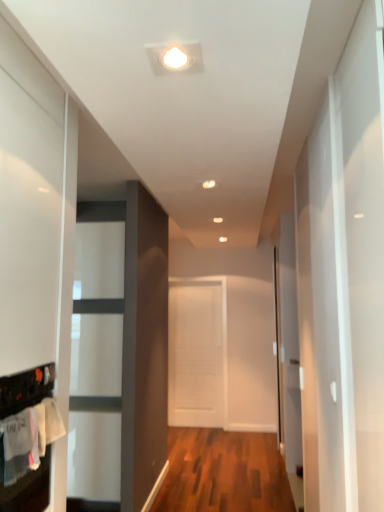
Question: From a real-world perspective, does white matte door at center sit lower than transparent glass door at right?

Choices:
 (A) yes
 (B) no

Answer: (A)

Question: Is white matte door at center taller than transparent glass door at right?

Choices:
 (A) yes
 (B) no

Answer: (B)

Question: Can you confirm if white matte door at center is wider than transparent glass door at right?

Choices:
 (A) no
 (B) yes

Answer: (A)

Question: Can you confirm if white matte door at center is smaller than transparent glass door at right?

Choices:
 (A) no
 (B) yes

Answer: (B)

Question: Would you say white matte door at center contains transparent glass door at right?

Choices:
 (A) yes
 (B) no

Answer: (B)

Question: Is white matte door at center outside transparent glass door at right?

Choices:
 (A) yes
 (B) no

Answer: (A)

Question: Is white cotton laundry at lower left thinner than white matte door at center?

Choices:
 (A) yes
 (B) no

Answer: (A)

Question: From the image's perspective, is white cotton laundry at lower left beneath white matte door at center?

Choices:
 (A) no
 (B) yes

Answer: (A)

Question: Can you confirm if white cotton laundry at lower left is smaller than white matte door at center?

Choices:
 (A) yes
 (B) no

Answer: (A)

Question: Considering the relative positions of white cotton laundry at lower left and white matte door at center in the image provided, is white cotton laundry at lower left to the right of white matte door at center from the viewer's perspective?

Choices:
 (A) yes
 (B) no

Answer: (B)

Question: Is the depth of white cotton laundry at lower left greater than that of white matte door at center?

Choices:
 (A) yes
 (B) no

Answer: (B)

Question: Does white cotton laundry at lower left have a lesser height compared to white matte door at center?

Choices:
 (A) no
 (B) yes

Answer: (B)

Question: Is transparent glass door at right at the right side of white matte door at center?

Choices:
 (A) no
 (B) yes

Answer: (B)